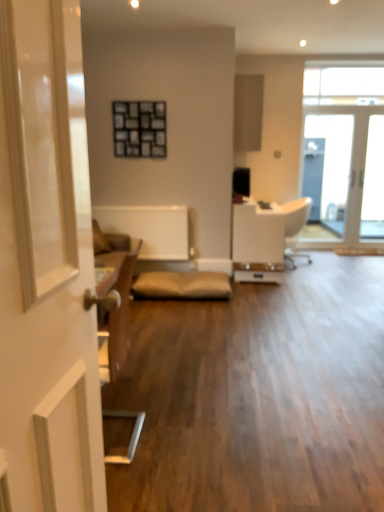
You are a GUI agent. You are given a task and a screenshot of the screen. Output one action in this format:
    pyautogui.click(x=<x>, y=<y>)
    Task: Click on the transparent glass window at upper right, which ranks as the 1th window in top-to-bottom order
    
    Given the screenshot: What is the action you would take?
    [343, 85]

Where is `white glossy door at left`? white glossy door at left is located at coordinates (45, 273).

Is white leather armchair at center at the back of white glossy door at left?

That's not correct — white glossy door at left is not looking away from white leather armchair at center.

From a real-world perspective, which object stands above the other?

white glossy door at left.

Considering the relative sizes of white glossy door at left and white leather armchair at center in the image provided, is white glossy door at left bigger than white leather armchair at center?

No, white glossy door at left is not bigger than white leather armchair at center.

From the image's perspective, relative to transparent glass window at upper right, which ranks as the 1th window in top-to-bottom order, is clear glass door at upper right, which is the first window in bottom-to-top order, above or below?

clear glass door at upper right, which is the first window in bottom-to-top order, is situated lower than transparent glass window at upper right, which ranks as the 1th window in top-to-bottom order, in the image.

Find the location of a particular element. The width and height of the screenshot is (384, 512). window behind the transparent glass window at upper right, arranged as the second window when ordered from the bottom is located at coordinates (347, 148).

Based on the photo, from a real-world perspective, is clear glass door at upper right, which is the first window in bottom-to-top order, physically located above or below transparent glass window at upper right, which ranks as the 1th window in top-to-bottom order?

In terms of real-world spatial position, clear glass door at upper right, which is the first window in bottom-to-top order, is below transparent glass window at upper right, which ranks as the 1th window in top-to-bottom order.

Considering the sizes of objects transparent glass window at upper right, arranged as the second window when ordered from the bottom, and white leather armchair at center in the image provided, who is shorter, transparent glass window at upper right, arranged as the second window when ordered from the bottom, or white leather armchair at center?

transparent glass window at upper right, arranged as the second window when ordered from the bottom, is shorter.

From the image's perspective, between transparent glass window at upper right, arranged as the second window when ordered from the bottom, and white leather armchair at center, which one is located above?

transparent glass window at upper right, arranged as the second window when ordered from the bottom, from the image's perspective.

Is point (335, 71) positioned after point (249, 251)?

Yes, it is.

Which of these two, matte wood cabinet at upper center or white glossy door at left, stands shorter?

Standing shorter between the two is matte wood cabinet at upper center.

Looking at this image, does matte wood cabinet at upper center have a larger size compared to white glossy door at left?

Correct, matte wood cabinet at upper center is larger in size than white glossy door at left.

Is matte wood cabinet at upper center not close to white glossy door at left?

Yes, matte wood cabinet at upper center and white glossy door at left are located far from each other.

Which object is positioned more to the left, matte wood cabinet at upper center or white glossy door at left?

Positioned to the left is white glossy door at left.

Which is more to the left, white leather armchair at center or white glossy door at left?

From the viewer's perspective, white glossy door at left appears more on the left side.

Does white leather armchair at center lie behind white glossy door at left?

That is True.

From a real-world perspective, which is physically above, white leather armchair at center or white glossy door at left?

white glossy door at left.

In terms of height, does white leather armchair at center look taller or shorter compared to white glossy door at left?

white leather armchair at center is shorter than white glossy door at left.

Is white glossy door at left facing towards clear glass door at upper right, marked as the second window in a top-to-bottom arrangement?

No, white glossy door at left is not oriented towards clear glass door at upper right, marked as the second window in a top-to-bottom arrangement.

Does white glossy door at left contain clear glass door at upper right, which is the first window in bottom-to-top order?

No.

In the scene shown: Considering the sizes of white glossy door at left and clear glass door at upper right, marked as the second window in a top-to-bottom arrangement, in the image, is white glossy door at left taller or shorter than clear glass door at upper right, marked as the second window in a top-to-bottom arrangement,?

white glossy door at left is shorter than clear glass door at upper right, marked as the second window in a top-to-bottom arrangement.

Is white glossy door at left positioned far away from clear glass door at upper right, which is the first window in bottom-to-top order?

Yes, white glossy door at left and clear glass door at upper right, which is the first window in bottom-to-top order, are located far from each other.

Considering the positions of objects clear glass door at upper right, which is the first window in bottom-to-top order, and matte wood cabinet at upper center in the image provided, who is more to the right, clear glass door at upper right, which is the first window in bottom-to-top order, or matte wood cabinet at upper center?

Positioned to the right is clear glass door at upper right, which is the first window in bottom-to-top order.

Is clear glass door at upper right, marked as the second window in a top-to-bottom arrangement, bigger than matte wood cabinet at upper center?

No, clear glass door at upper right, marked as the second window in a top-to-bottom arrangement, is not bigger than matte wood cabinet at upper center.

Considering the relative sizes of clear glass door at upper right, marked as the second window in a top-to-bottom arrangement, and matte wood cabinet at upper center in the image provided, is clear glass door at upper right, marked as the second window in a top-to-bottom arrangement, shorter than matte wood cabinet at upper center?

No.

From the image's perspective, would you say clear glass door at upper right, marked as the second window in a top-to-bottom arrangement, is positioned over matte wood cabinet at upper center?

Incorrect, from the image's perspective, clear glass door at upper right, marked as the second window in a top-to-bottom arrangement, is lower than matte wood cabinet at upper center.

Identify the location of armchair that is above the white glossy door at left (from the image's perspective). (265, 236).

Where is `window in front of the clear glass door at upper right, marked as the second window in a top-to-bottom arrangement`? window in front of the clear glass door at upper right, marked as the second window in a top-to-bottom arrangement is located at coordinates (343, 85).

Which object lies nearer to the anchor point white leather armchair at center, matte wood cabinet at upper center or clear glass door at upper right, marked as the second window in a top-to-bottom arrangement?

The object closer to white leather armchair at center is matte wood cabinet at upper center.

From the image, which object appears to be farther from matte wood cabinet at upper center, white leather armchair at center or clear glass door at upper right, marked as the second window in a top-to-bottom arrangement?

clear glass door at upper right, marked as the second window in a top-to-bottom arrangement, is positioned further to the anchor matte wood cabinet at upper center.

Which object lies further to the anchor point transparent glass window at upper right, which ranks as the 1th window in top-to-bottom order, matte wood cabinet at upper center or clear glass door at upper right, marked as the second window in a top-to-bottom arrangement?

matte wood cabinet at upper center lies further to transparent glass window at upper right, which ranks as the 1th window in top-to-bottom order, than the other object.

Looking at the image, which one is located further to white leather armchair at center, white glossy door at left or clear glass door at upper right, marked as the second window in a top-to-bottom arrangement?

white glossy door at left lies further to white leather armchair at center than the other object.

Consider the image. Which object lies further to the anchor point white glossy door at left, matte wood cabinet at upper center or clear glass door at upper right, marked as the second window in a top-to-bottom arrangement?

Based on the image, clear glass door at upper right, marked as the second window in a top-to-bottom arrangement, appears to be further to white glossy door at left.

From the image, which object appears to be nearer to transparent glass window at upper right, which ranks as the 1th window in top-to-bottom order, white leather armchair at center or matte wood cabinet at upper center?

matte wood cabinet at upper center lies closer to transparent glass window at upper right, which ranks as the 1th window in top-to-bottom order, than the other object.

Considering their positions, is clear glass door at upper right, which is the first window in bottom-to-top order, positioned closer to matte wood cabinet at upper center than white leather armchair at center?

white leather armchair at center is closer to matte wood cabinet at upper center.

Looking at the image, which one is located closer to white leather armchair at center, white glossy door at left or transparent glass window at upper right, arranged as the second window when ordered from the bottom?

Among the two, transparent glass window at upper right, arranged as the second window when ordered from the bottom, is located nearer to white leather armchair at center.

The width and height of the screenshot is (384, 512). I want to click on cabinetry between white glossy door at left and transparent glass window at upper right, which ranks as the 1th window in top-to-bottom order, along the z-axis, so click(x=248, y=112).

Image resolution: width=384 pixels, height=512 pixels. Identify the location of window that lies between transparent glass window at upper right, which ranks as the 1th window in top-to-bottom order, and white leather armchair at center from top to bottom. [347, 148].

In order to click on cabinetry positioned between white glossy door at left and clear glass door at upper right, which is the first window in bottom-to-top order, from near to far in this screenshot , I will do `click(248, 112)`.

Locate an element on the screen. This screenshot has height=512, width=384. window between white glossy door at left and clear glass door at upper right, marked as the second window in a top-to-bottom arrangement, in the front-back direction is located at coordinates (343, 85).